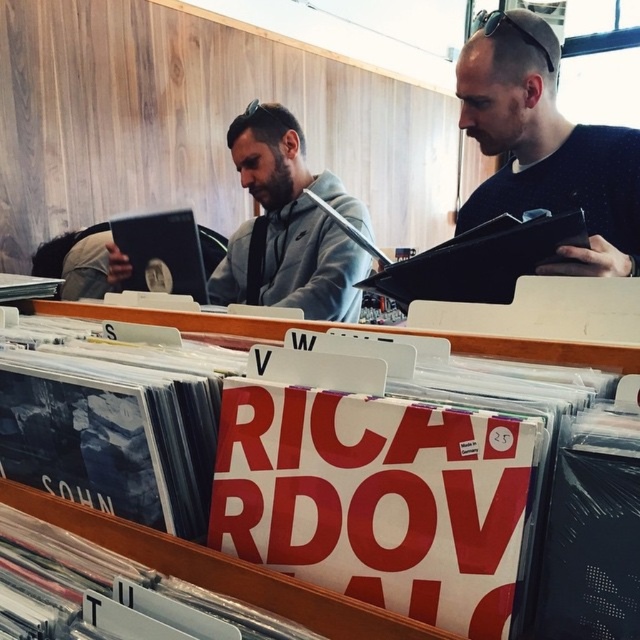
Does black matte book at upper right have a larger size compared to gray matte hoodie at center?

Incorrect, black matte book at upper right is not larger than gray matte hoodie at center.

In the scene shown: Does black matte book at upper right have a greater width compared to gray matte hoodie at center?

Incorrect, black matte book at upper right's width does not surpass gray matte hoodie at center's.

Locate an element on the screen. The height and width of the screenshot is (640, 640). black matte book at upper right is located at coordinates (545, 147).

Does white plastic record case at center have a greater height compared to gray matte hoodie at center?

No, white plastic record case at center is not taller than gray matte hoodie at center.

Where is `white plastic record case at center`? white plastic record case at center is located at coordinates (317, 472).

The height and width of the screenshot is (640, 640). What do you see at coordinates (317, 472) in the screenshot?
I see `white plastic record case at center` at bounding box center [317, 472].

In the scene shown: Can you confirm if white plastic record case at center is positioned to the left of black matte book at upper right?

Yes, white plastic record case at center is to the left of black matte book at upper right.

Between point (257, 422) and point (481, 186), which one is positioned in front?

Positioned in front is point (257, 422).

You are a GUI agent. You are given a task and a screenshot of the screen. Output one action in this format:
    pyautogui.click(x=<x>, y=<y>)
    Task: Click on the white plastic record case at center
    This screenshot has height=640, width=640.
    Given the screenshot: What is the action you would take?
    pyautogui.click(x=317, y=472)